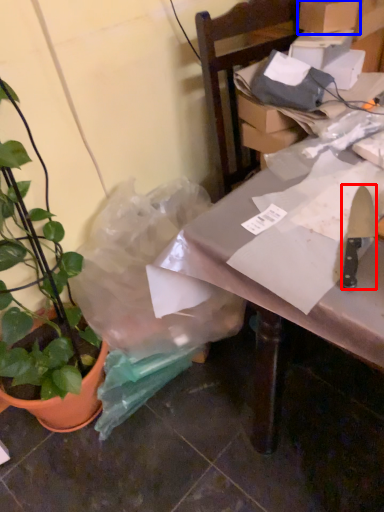
Question: Which of the following is the farthest to the observer, kitchen knife (highlighted by a red box) or cardboard box (highlighted by a blue box)?

Choices:
 (A) kitchen knife
 (B) cardboard box

Answer: (B)